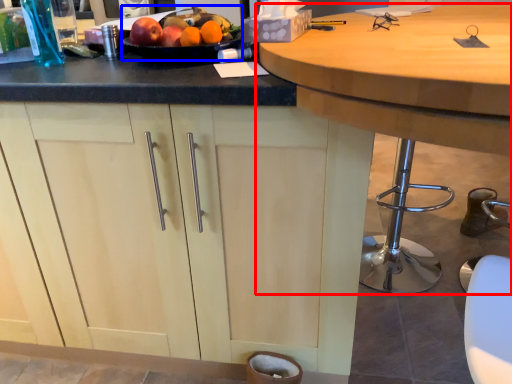
Question: Which object is further to the camera taking this photo, table (highlighted by a red box) or fruit dish (highlighted by a blue box)?

Choices:
 (A) table
 (B) fruit dish

Answer: (B)